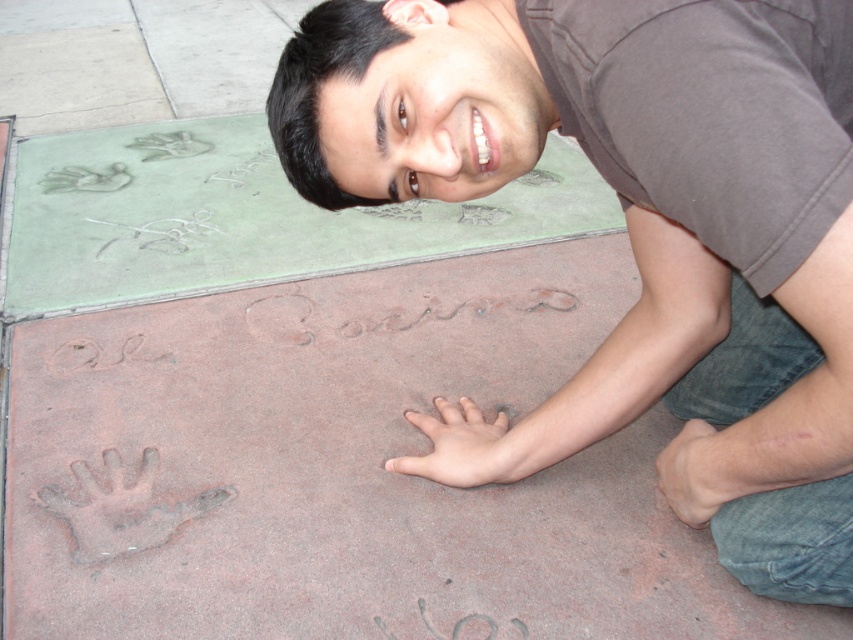
Question: Which point is farther from the camera taking this photo?

Choices:
 (A) (757, 333)
 (B) (444, 428)
 (C) (676, 451)

Answer: (B)

Question: Can you confirm if matte brown shirt at center is wider than brown matte handprint at lower center?

Choices:
 (A) yes
 (B) no

Answer: (A)

Question: Which of the following is the farthest from the observer?

Choices:
 (A) (824, 136)
 (B) (694, 470)
 (C) (503, 483)

Answer: (C)

Question: In this image, where is matte brown shirt at center located relative to pink flesh-colored hand at center?

Choices:
 (A) left
 (B) right

Answer: (B)

Question: Estimate the real-world distances between objects in this image. Which object is farther from the matte brown shirt at center?

Choices:
 (A) pink flesh-colored hand at center
 (B) brown matte handprint at lower center

Answer: (A)

Question: Does pink flesh-colored hand at center have a lesser width compared to brown matte handprint at lower center?

Choices:
 (A) no
 (B) yes

Answer: (A)